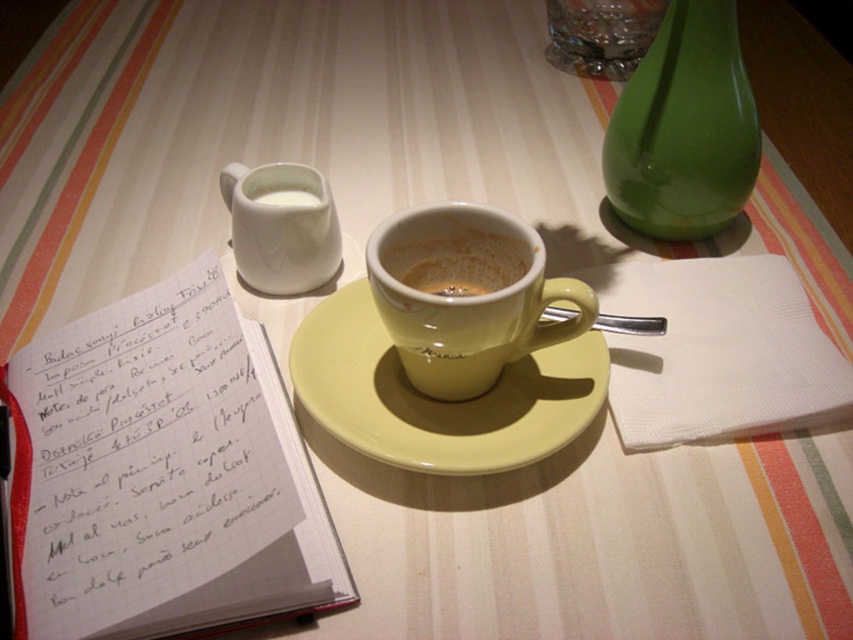
You are a barista preparing drinks and need to place both the matte ceramic mug at center and the white glossy mug at upper center on a shelf that can only hold items up to 10 cm in width. Given their widths, can both mugs fit side by side on the shelf?

The matte ceramic mug at center is wider than the white glossy mug at upper center. Since the shelf can only hold items up to 10 cm in width, both mugs can fit side by side only if their combined width does not exceed 10 cm. However, without knowing their exact widths, we cannot confirm if they will fit together.

You are a barista preparing a latte and need to place the white matte creamer at upper left next to the yellow glossy saucer at center. Based on their positions, where should you place the creamer relative to the saucer?

The yellow glossy saucer at center is already to the right of the white matte creamer at upper left, so the creamer is already positioned to the left of the saucer. Therefore, the creamer is correctly placed next to the saucer on its left side.